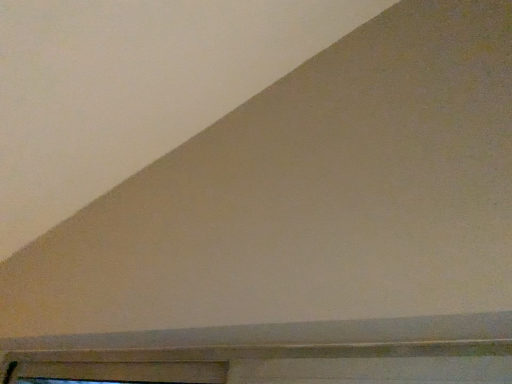
This screenshot has width=512, height=384. What do you see at coordinates (123, 372) in the screenshot?
I see `wooden frame at bottom` at bounding box center [123, 372].

Locate an element on the screen. wooden frame at bottom is located at coordinates click(x=123, y=372).

Where is `wooden frame at bottom`? The image size is (512, 384). wooden frame at bottom is located at coordinates (123, 372).